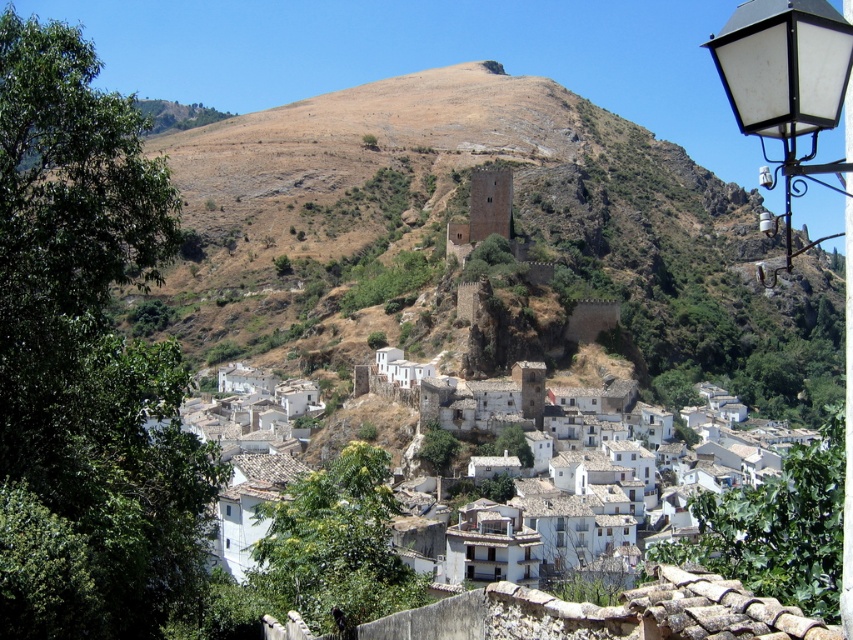
Question: Is brown rocky mountain at center further to the viewer compared to white matte street light at upper right?

Choices:
 (A) yes
 (B) no

Answer: (A)

Question: Which object appears closest to the camera in this image?

Choices:
 (A) white stone buildings at center
 (B) white matte street light at upper right

Answer: (B)

Question: Which point appears closest to the camera in this image?

Choices:
 (A) (219, 417)
 (B) (207, 177)

Answer: (A)

Question: Can you confirm if brown rocky mountain at center is positioned above white stone buildings at center?

Choices:
 (A) yes
 (B) no

Answer: (A)

Question: Does white matte street light at upper right have a larger size compared to white stone buildings at center?

Choices:
 (A) no
 (B) yes

Answer: (B)

Question: Which point is closer to the camera?

Choices:
 (A) (828, 90)
 (B) (199, 408)

Answer: (A)